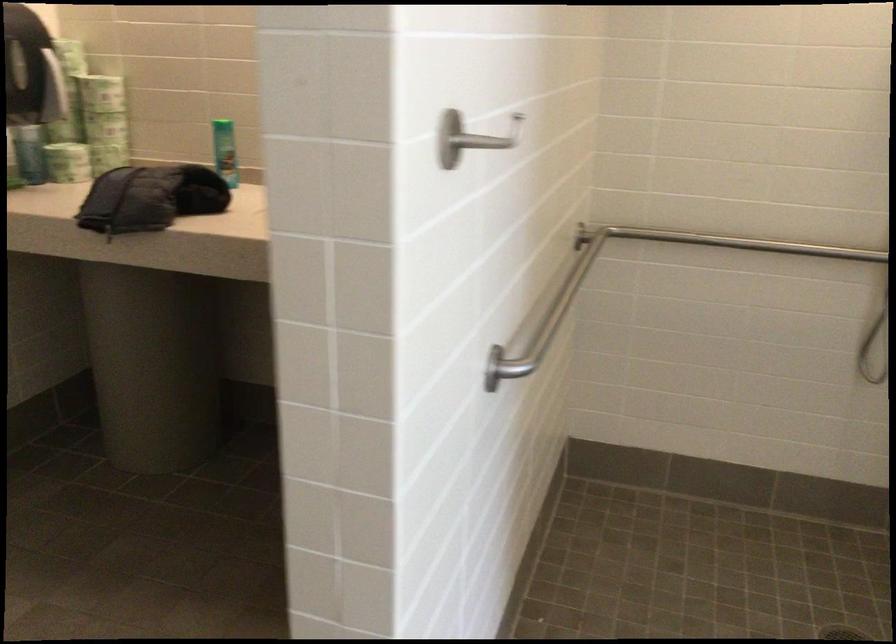
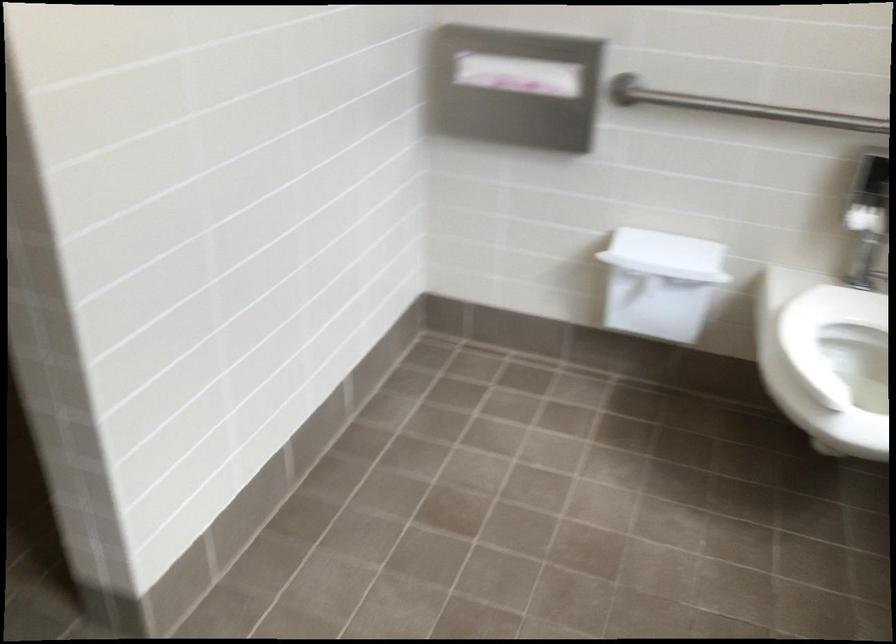
Question: In a continuous first-person perspective shot, in which direction is the camera moving?

Choices:
 (A) Left
 (B) Right
 (C) Forward
 (D) Backward

Answer: (B)